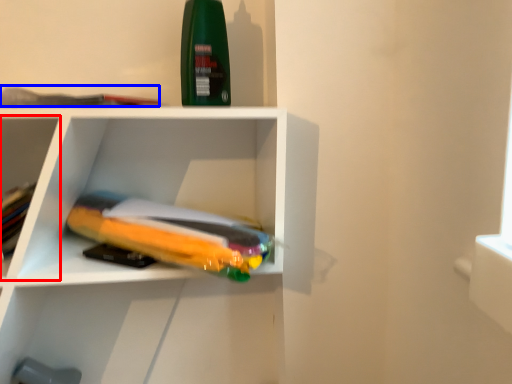
Question: Which of the following is the farthest to the observer, shelf (highlighted by a red box) or book (highlighted by a blue box)?

Choices:
 (A) shelf
 (B) book

Answer: (A)